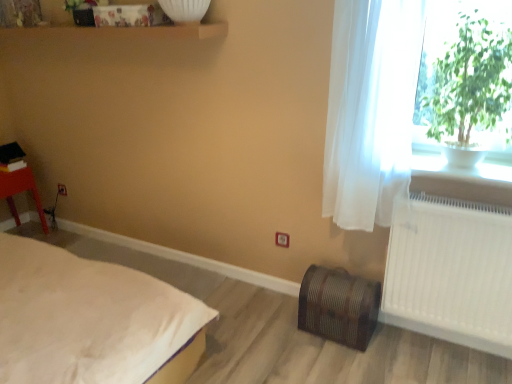
Describe the element at coordinates (371, 110) in the screenshot. Image resolution: width=512 pixels, height=384 pixels. I see `white sheer curtain at right` at that location.

This screenshot has width=512, height=384. Describe the element at coordinates (86, 318) in the screenshot. I see `white soft bed at lower left` at that location.

Find the location of a particular element. white ceramic pot at upper right is located at coordinates (461, 170).

Image resolution: width=512 pixels, height=384 pixels. Identify the location of white plastic radiator at right. pyautogui.click(x=452, y=273).

Between white sheer curtain at right and white plastic radiator at right, which one has more height?

Standing taller between the two is white sheer curtain at right.

Does point (415, 45) appear closer or farther from the camera than point (431, 237)?

Point (415, 45).

Find the location of a particular element. The height and width of the screenshot is (384, 512). radiator below the white sheer curtain at right (from a real-world perspective) is located at coordinates (452, 273).

Between white sheer curtain at right and white plastic radiator at right, which one has smaller size?

Smaller between the two is white plastic radiator at right.

Considering the points (417, 12) and (180, 296), which point is behind, point (417, 12) or point (180, 296)?

The point (180, 296) is farther.

Is white sheer curtain at right oriented towards white soft bed at lower left?

No, white sheer curtain at right is not aimed at white soft bed at lower left.

From a real-world perspective, who is located higher, white sheer curtain at right or white soft bed at lower left?

In real-world perspective, white sheer curtain at right is above.

Where is `bed below the white sheer curtain at right (from a real-world perspective)`? The height and width of the screenshot is (384, 512). bed below the white sheer curtain at right (from a real-world perspective) is located at coordinates 86,318.

Is white ceramic pot at upper right located outside green leafy plant at upper right?

Yes, white ceramic pot at upper right is not within green leafy plant at upper right.

From the picture: Considering the relative positions of white ceramic pot at upper right and green leafy plant at upper right in the image provided, is white ceramic pot at upper right to the right of green leafy plant at upper right from the viewer's perspective?

Yes, white ceramic pot at upper right is to the right of green leafy plant at upper right.

Considering the sizes of white ceramic pot at upper right and green leafy plant at upper right in the image, is white ceramic pot at upper right taller or shorter than green leafy plant at upper right?

In the image, white ceramic pot at upper right appears to be shorter than green leafy plant at upper right.

Considering the relative positions of white soft bed at lower left and white plastic radiator at right in the image provided, is white soft bed at lower left to the right of white plastic radiator at right from the viewer's perspective?

No, white soft bed at lower left is not to the right of white plastic radiator at right.

The image size is (512, 384). In order to click on radiator on the right of white soft bed at lower left in this screenshot , I will do `click(452, 273)`.

Considering the sizes of objects white soft bed at lower left and white plastic radiator at right in the image provided, who is taller, white soft bed at lower left or white plastic radiator at right?

white soft bed at lower left.

Between point (146, 315) and point (488, 207), which one is positioned in front?

The point (146, 315) is closer.

From a real-world perspective, is matte plastic stool at left positioned above or below white plastic radiator at right?

From a real-world perspective, matte plastic stool at left is physically below white plastic radiator at right.

Are matte plastic stool at left and white plastic radiator at right far apart?

Yes, matte plastic stool at left and white plastic radiator at right are located far from each other.

Is matte plastic stool at left spatially inside white plastic radiator at right, or outside of it?

matte plastic stool at left lies outside white plastic radiator at right.

Does matte plastic stool at left have a larger size compared to white plastic radiator at right?

Correct, matte plastic stool at left is larger in size than white plastic radiator at right.

Between matte plastic stool at left and green leafy plant at upper right, which one has more height?

With more height is green leafy plant at upper right.

Does matte plastic stool at left turn towards green leafy plant at upper right?

Yes.

Considering the points (41, 212) and (456, 56), which point is behind, point (41, 212) or point (456, 56)?

Positioned behind is point (41, 212).

In the image, is white soft bed at lower left on the left side or the right side of white ceramic pot at upper right?

Based on their positions, white soft bed at lower left is located to the left of white ceramic pot at upper right.

From a real-world perspective, is white soft bed at lower left on top of white ceramic pot at upper right?

No, from a real-world perspective, white soft bed at lower left is not on top of white ceramic pot at upper right.

Does white soft bed at lower left have a lesser width compared to white ceramic pot at upper right?

Incorrect, the width of white soft bed at lower left is not less than that of white ceramic pot at upper right.

This screenshot has width=512, height=384. Find the location of `radiator below the white sheer curtain at right (from the image's perspective)`. radiator below the white sheer curtain at right (from the image's perspective) is located at coordinates (452, 273).

In order to click on bed in front of the white sheer curtain at right in this screenshot , I will do `click(86, 318)`.

When comparing their distances from white ceramic pot at upper right, does white soft bed at lower left or matte plastic stool at left seem further?

matte plastic stool at left is further to white ceramic pot at upper right.

Looking at the image, which one is located closer to white sheer curtain at right, white plastic radiator at right or white soft bed at lower left?

white plastic radiator at right is closer to white sheer curtain at right.

Based on their spatial positions, is white sheer curtain at right or matte plastic stool at left closer to green leafy plant at upper right?

white sheer curtain at right lies closer to green leafy plant at upper right than the other object.

Which object lies further to the anchor point white sheer curtain at right, white soft bed at lower left or green leafy plant at upper right?

Among the two, white soft bed at lower left is located further to white sheer curtain at right.

Considering their positions, is white soft bed at lower left positioned closer to green leafy plant at upper right than white plastic radiator at right?

white plastic radiator at right.

Based on their spatial positions, is white ceramic pot at upper right or matte plastic stool at left further from white sheer curtain at right?

matte plastic stool at left.

Estimate the real-world distances between objects in this image. Which object is further from green leafy plant at upper right, white sheer curtain at right or white ceramic pot at upper right?

Among the two, white ceramic pot at upper right is located further to green leafy plant at upper right.

When comparing their distances from matte plastic stool at left, does white plastic radiator at right or green leafy plant at upper right seem further?

green leafy plant at upper right.

The image size is (512, 384). Find the location of `plant between white soft bed at lower left and white plastic radiator at right in the horizontal direction`. plant between white soft bed at lower left and white plastic radiator at right in the horizontal direction is located at coordinates (469, 80).

This screenshot has height=384, width=512. Identify the location of curtain that lies between green leafy plant at upper right and white plastic radiator at right from top to bottom. (371, 110).

Locate an element on the screen. curtain between matte plastic stool at left and white plastic radiator at right in the horizontal direction is located at coordinates (371, 110).

Find the location of `plant between matte plastic stool at left and white ceramic pot at upper right`. plant between matte plastic stool at left and white ceramic pot at upper right is located at coordinates (469, 80).